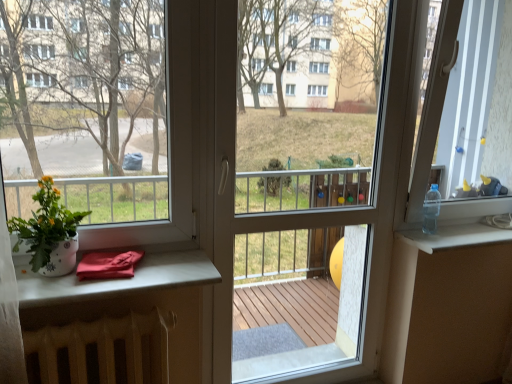
Image resolution: width=512 pixels, height=384 pixels. Find the location of `empty space that is ontop of transparent plastic bottle at upper right (from a real-world perspective)`. empty space that is ontop of transparent plastic bottle at upper right (from a real-world perspective) is located at coordinates (474, 229).